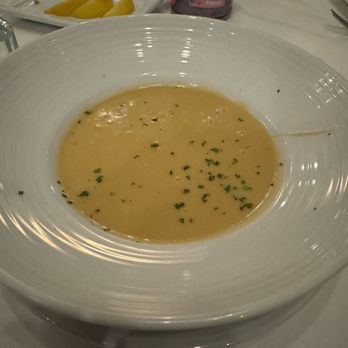
You are a GUI agent. You are given a task and a screenshot of the screen. Output one action in this format:
    pyautogui.click(x=<x>, y=<y>)
    Task: Click on the table
    The image size is (348, 348).
    Given the screenshot: What is the action you would take?
    pyautogui.click(x=287, y=334)